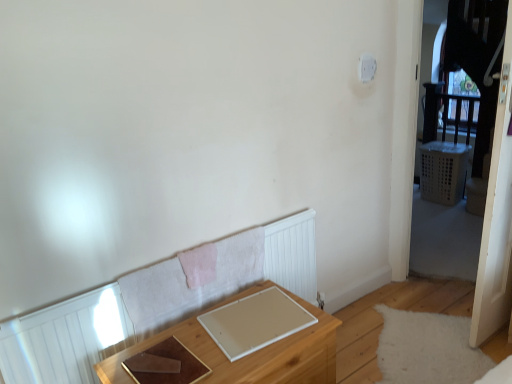
Question: From a real-world perspective, relative to wooden table at lower center, is white plastic light switch at upper right vertically above or below?

Choices:
 (A) above
 (B) below

Answer: (A)

Question: Considering the positions of white plastic light switch at upper right and wooden table at lower center in the image, is white plastic light switch at upper right wider or thinner than wooden table at lower center?

Choices:
 (A) thin
 (B) wide

Answer: (A)

Question: Estimate the real-world distances between objects in this image. Which object is closer to the wooden table at lower center?

Choices:
 (A) transparent plastic screen door at right
 (B) white plastic light switch at upper right

Answer: (A)

Question: Which of these objects is positioned closest to the white plastic light switch at upper right?

Choices:
 (A) transparent plastic screen door at right
 (B) wooden table at lower center

Answer: (A)